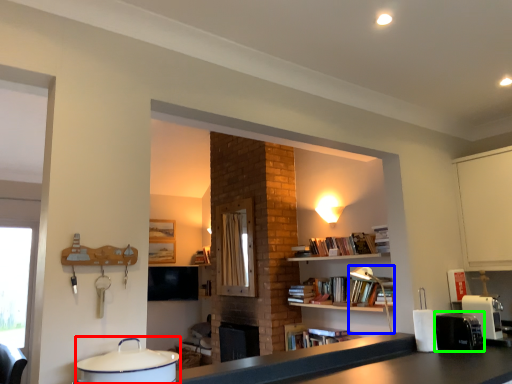
Question: Based on their relative distances, which object is farther from appliance (highlighted by a red box)? Choose from lamp (highlighted by a blue box) and appliance (highlighted by a green box).

Choices:
 (A) lamp
 (B) appliance

Answer: (A)